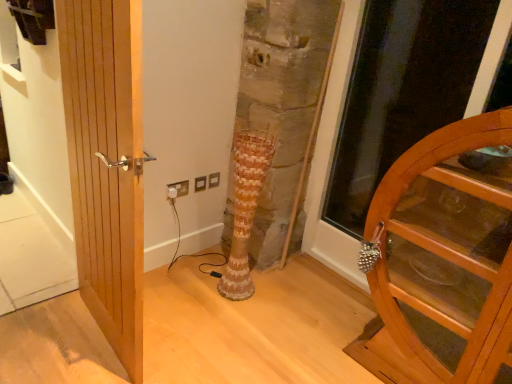
Question: From the image's perspective, would you say transparent wooden door at right is positioned over brown textured vase at center?

Choices:
 (A) yes
 (B) no

Answer: (A)

Question: Is transparent wooden door at right taller than brown textured vase at center?

Choices:
 (A) no
 (B) yes

Answer: (B)

Question: From a real-world perspective, is transparent wooden door at right positioned over brown textured vase at center based on gravity?

Choices:
 (A) yes
 (B) no

Answer: (A)

Question: Is transparent wooden door at right positioned before brown textured vase at center?

Choices:
 (A) yes
 (B) no

Answer: (A)

Question: Can you confirm if transparent wooden door at right is wider than brown textured vase at center?

Choices:
 (A) no
 (B) yes

Answer: (B)

Question: Is brown textured vase at center inside transparent wooden door at right?

Choices:
 (A) no
 (B) yes

Answer: (A)

Question: Is white plastic electric outlet at lower center facing away from wooden cabinet at right, which is the second door in left-to-right order?

Choices:
 (A) no
 (B) yes

Answer: (A)

Question: Is wooden cabinet at right, the first door positioned from the right, a part of white plastic electric outlet at lower center?

Choices:
 (A) yes
 (B) no

Answer: (B)

Question: Is white plastic electric outlet at lower center touching wooden cabinet at right, the first door positioned from the right?

Choices:
 (A) no
 (B) yes

Answer: (A)

Question: Considering the relative positions of white plastic electric outlet at lower center and wooden cabinet at right, the first door positioned from the right, in the image provided, is white plastic electric outlet at lower center to the right of wooden cabinet at right, the first door positioned from the right, from the viewer's perspective?

Choices:
 (A) yes
 (B) no

Answer: (B)

Question: From a real-world perspective, is white plastic electric outlet at lower center over wooden cabinet at right, the first door positioned from the right?

Choices:
 (A) yes
 (B) no

Answer: (B)

Question: From the image's perspective, is white plastic electric outlet at lower center below wooden cabinet at right, which is the second door in left-to-right order?

Choices:
 (A) yes
 (B) no

Answer: (B)

Question: Is brown textured vase at center facing away from natural wood door at left, which is the first door from left to right?

Choices:
 (A) yes
 (B) no

Answer: (B)